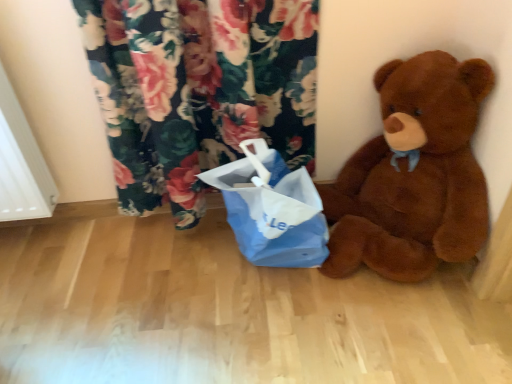
The height and width of the screenshot is (384, 512). I want to click on brown plush teddy bear at right, so click(413, 174).

What do you see at coordinates (413, 174) in the screenshot?
I see `brown plush teddy bear at right` at bounding box center [413, 174].

Measure the distance between point (422,55) and camera.

The distance of point (422,55) from camera is 1.16 meters.

At what (x,y) coordinates should I click in order to perform the action: click on blue paper bag at center. Please return your answer as a coordinate pair (x, y). The image size is (512, 384). Looking at the image, I should click on (272, 209).

Describe the element at coordinates (272, 209) in the screenshot. The width and height of the screenshot is (512, 384). I see `blue paper bag at center` at that location.

Locate an element on the screen. The width and height of the screenshot is (512, 384). brown plush teddy bear at right is located at coordinates (413, 174).

Considering the relative positions of blue paper bag at center and brown plush teddy bear at right in the image provided, is blue paper bag at center to the right of brown plush teddy bear at right from the viewer's perspective?

No, blue paper bag at center is not to the right of brown plush teddy bear at right.

Looking at this image, is blue paper bag at center positioned in front of brown plush teddy bear at right?

No, blue paper bag at center is further to the viewer.

Is point (239, 192) positioned after point (356, 173)?

No.

From the image's perspective, which is below, blue paper bag at center or brown plush teddy bear at right?

From the image's view, blue paper bag at center is below.

From a real-world perspective, relative to brown plush teddy bear at right, is blue paper bag at center vertically above or below?

Clearly, from a real-world perspective, blue paper bag at center is below brown plush teddy bear at right.

Between blue paper bag at center and brown plush teddy bear at right, which one has smaller width?

blue paper bag at center is thinner.

In terms of height, does blue paper bag at center look taller or shorter compared to brown plush teddy bear at right?

In the image, blue paper bag at center appears to be shorter than brown plush teddy bear at right.

Considering the sizes of blue paper bag at center and brown plush teddy bear at right in the image, is blue paper bag at center bigger or smaller than brown plush teddy bear at right?

In the image, blue paper bag at center appears to be smaller than brown plush teddy bear at right.

Would you say blue paper bag at center is inside or outside brown plush teddy bear at right?

The correct answer is: outside.

Is blue paper bag at center positioned far away from brown plush teddy bear at right?

No, blue paper bag at center is not far away from brown plush teddy bear at right.

Consider the image. Could you tell me if blue paper bag at center is facing brown plush teddy bear at right?

No, blue paper bag at center does not turn towards brown plush teddy bear at right.

Can you tell me how much blue paper bag at center and brown plush teddy bear at right differ in facing direction?

blue paper bag at center and brown plush teddy bear at right are facing 1.82e-05 degrees away from each other.

At what (x,y) coordinates should I click in order to perform the action: click on teddy bear located in front of the blue paper bag at center. Please return your answer as a coordinate pair (x, y). Looking at the image, I should click on (413, 174).

Between brown plush teddy bear at right and blue paper bag at center, which one appears on the right side from the viewer's perspective?

brown plush teddy bear at right is more to the right.

Is brown plush teddy bear at right in front of or behind blue paper bag at center in the image?

brown plush teddy bear at right is in front of blue paper bag at center.

Is point (426, 196) positioned before point (254, 264)?

Yes, it is.

From the image's perspective, which object appears higher, brown plush teddy bear at right or blue paper bag at center?

brown plush teddy bear at right is shown above in the image.

From a real-world perspective, is brown plush teddy bear at right physically above blue paper bag at center?

Yes, from a real-world perspective, brown plush teddy bear at right is on top of blue paper bag at center.

Between brown plush teddy bear at right and blue paper bag at center, which one has smaller width?

blue paper bag at center.

From their relative heights in the image, would you say brown plush teddy bear at right is taller or shorter than blue paper bag at center?

Considering their sizes, brown plush teddy bear at right has more height than blue paper bag at center.

Who is smaller, brown plush teddy bear at right or blue paper bag at center?

With smaller size is blue paper bag at center.

Is brown plush teddy bear at right inside or outside of blue paper bag at center?

brown plush teddy bear at right is outside blue paper bag at center.

Does brown plush teddy bear at right touch blue paper bag at center?

No, brown plush teddy bear at right is not next to blue paper bag at center.

Is brown plush teddy bear at right facing away from blue paper bag at center?

brown plush teddy bear at right is not turned away from blue paper bag at center.

How different are the orientations of brown plush teddy bear at right and blue paper bag at center in degrees?

The facing directions of brown plush teddy bear at right and blue paper bag at center are 1.82e-05 degrees apart.

Measure the distance from brown plush teddy bear at right to blue paper bag at center.

brown plush teddy bear at right is 10.02 inches from blue paper bag at center.

Locate an element on the screen. shopping bag below the brown plush teddy bear at right (from the image's perspective) is located at coordinates (272, 209).

The image size is (512, 384). What are the coordinates of `teddy bear above the blue paper bag at center (from a real-world perspective)` in the screenshot? It's located at (413, 174).

Find the location of a particular element. The height and width of the screenshot is (384, 512). shopping bag below the brown plush teddy bear at right (from a real-world perspective) is located at coordinates (272, 209).